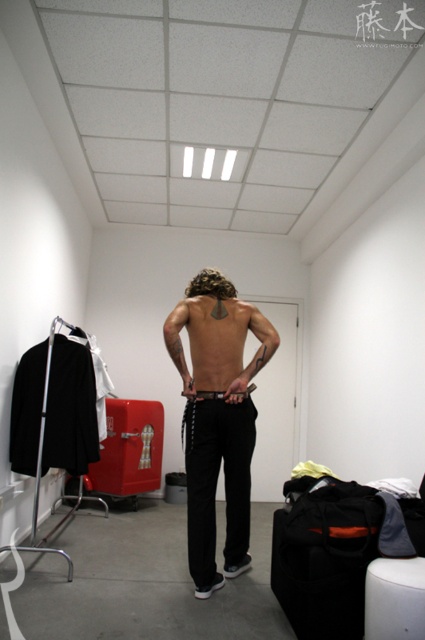
Question: Can you confirm if black matte pants at center is smaller than black leather belt at center?

Choices:
 (A) no
 (B) yes

Answer: (A)

Question: Which object is the closest to the black matte pants at center?

Choices:
 (A) black leather belt at center
 (B) white plastic stool at lower right

Answer: (A)

Question: Based on their relative distances, which object is farther from the black leather belt at center?

Choices:
 (A) white plastic stool at lower right
 (B) black matte pants at center

Answer: (A)

Question: Which of the following is the farthest from the observer?

Choices:
 (A) (419, 584)
 (B) (249, 426)

Answer: (B)

Question: Can you confirm if black matte pants at center is positioned below white plastic stool at lower right?

Choices:
 (A) yes
 (B) no

Answer: (B)

Question: Does white plastic stool at lower right appear under black leather belt at center?

Choices:
 (A) yes
 (B) no

Answer: (A)